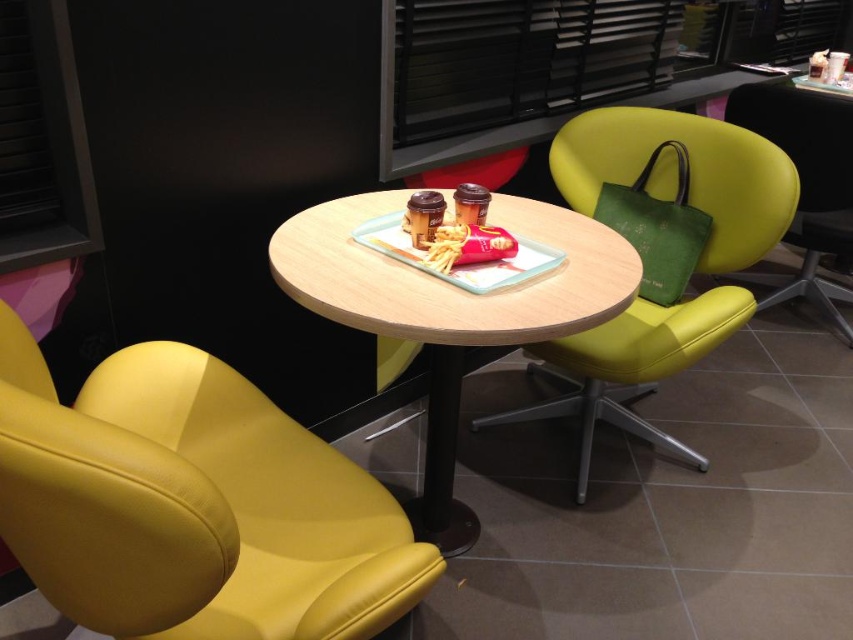
I want to click on matte yellow swivel chair at center, so click(x=682, y=173).

Can you confirm if matte yellow swivel chair at center is bigger than green leather chair at upper right?

Indeed, matte yellow swivel chair at center has a larger size compared to green leather chair at upper right.

Which is in front, point (585, 195) or point (801, 132)?

Positioned in front is point (585, 195).

In order to click on matte yellow swivel chair at center in this screenshot , I will do click(682, 173).

Locate an element on the screen. Image resolution: width=853 pixels, height=640 pixels. yellow leather swivel chair at lower left is located at coordinates (192, 504).

Who is lower down, yellow leather swivel chair at lower left or matte yellow swivel chair at center?

yellow leather swivel chair at lower left

This screenshot has width=853, height=640. Find the location of `yellow leather swivel chair at lower left`. yellow leather swivel chair at lower left is located at coordinates (192, 504).

Does yellow leather swivel chair at lower left have a greater height compared to green leather chair at upper right?

Incorrect, yellow leather swivel chair at lower left's height is not larger of green leather chair at upper right's.

Measure the distance between yellow leather swivel chair at lower left and green leather chair at upper right.

7.60 feet

Is point (113, 618) less distant than point (799, 224)?

That is True.

The width and height of the screenshot is (853, 640). I want to click on yellow leather swivel chair at lower left, so click(192, 504).